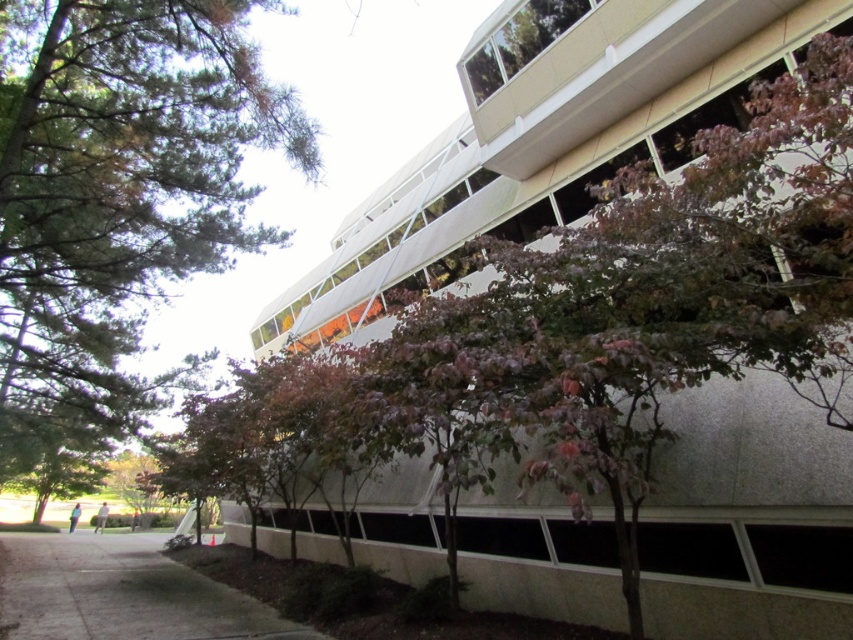
Who is taller, green leafy tree at upper left or gray concrete pavement at lower left?

green leafy tree at upper left is taller.

Is point (24, 456) closer to viewer compared to point (142, 536)?

Yes.

What do you see at coordinates (119, 196) in the screenshot?
I see `green leafy tree at upper left` at bounding box center [119, 196].

Find the location of a particular element. green leafy tree at upper left is located at coordinates (119, 196).